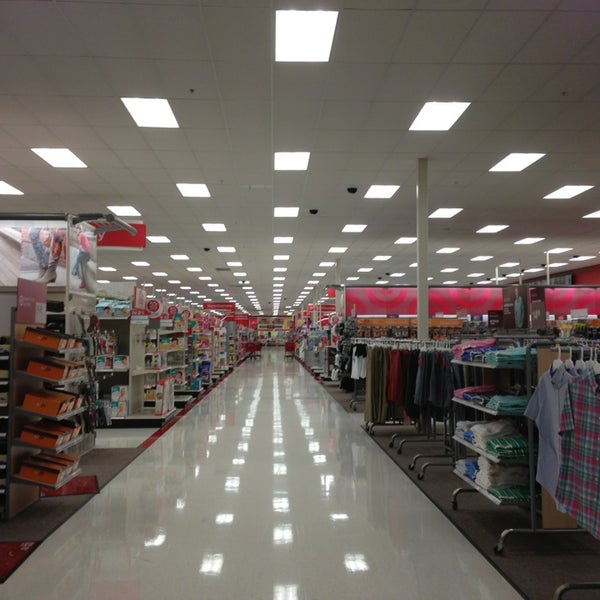
Identify the location of shoe boxes holding shoes. (63, 343), (46, 404).